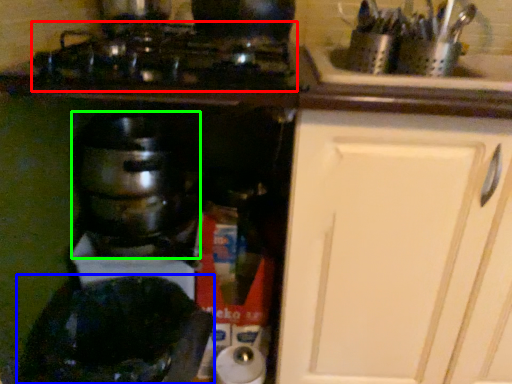
Question: Which is farther away from gas stove (highlighted by a red box)? appliance (highlighted by a blue box) or kitchen appliance (highlighted by a green box)?

Choices:
 (A) appliance
 (B) kitchen appliance

Answer: (A)